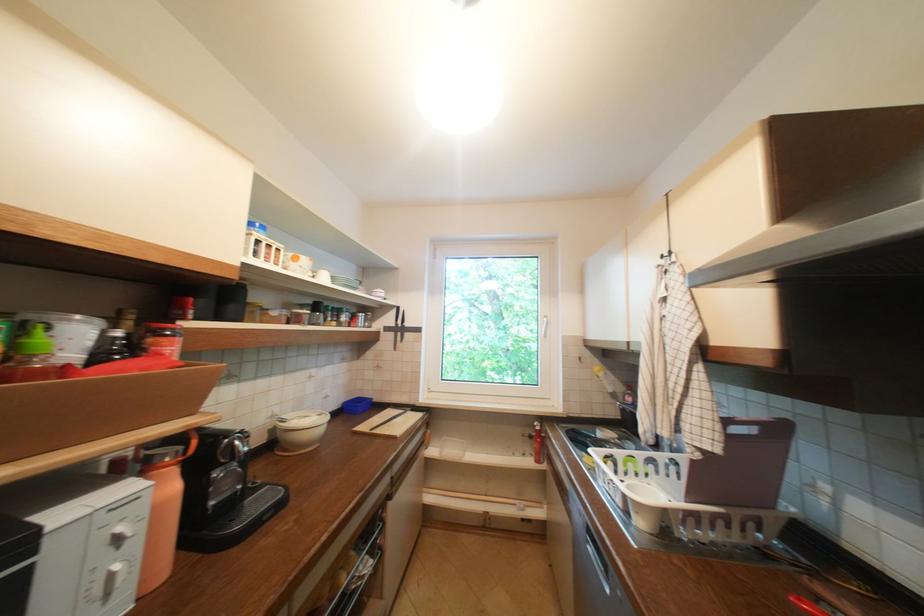
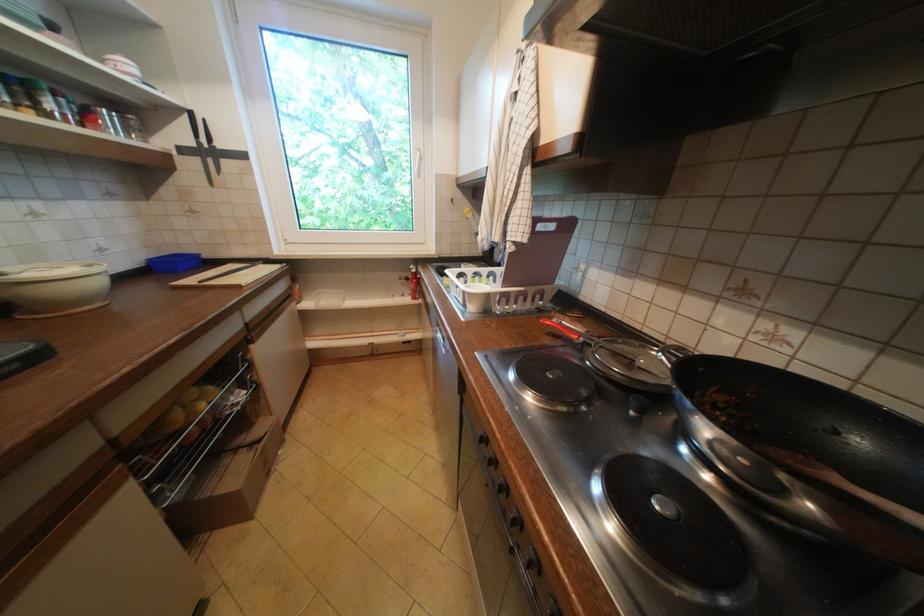
The point at (812, 562) is marked in the first image. Where is the corresponding point in the second image?

(565, 310)